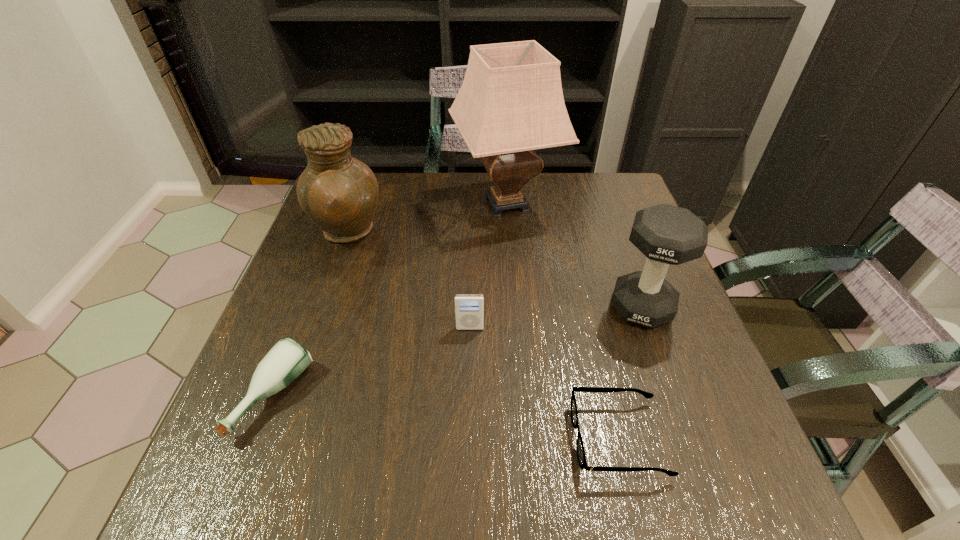
Where is `the tallest object`? The width and height of the screenshot is (960, 540). the tallest object is located at coordinates (511, 102).

Locate an element on the screen. the fifth shortest object is located at coordinates (339, 193).

Where is `dumbbell`? dumbbell is located at coordinates (667, 235).

Locate an element on the screen. The height and width of the screenshot is (540, 960). the fourth tallest object is located at coordinates (469, 308).

Find the location of a particular element. the fifth tallest object is located at coordinates (287, 359).

Identify the location of spectacles. The image size is (960, 540). (581, 456).

Locate an element on the screen. The image size is (960, 540). free space located 0.300m on the front of the lampshade is located at coordinates (516, 328).

Image resolution: width=960 pixels, height=540 pixels. I want to click on free space located at the spout of the pitcher, so click(x=490, y=233).

The height and width of the screenshot is (540, 960). Identify the location of free space located 0.380m on the left of the fourth shortest object. (438, 307).

This screenshot has height=540, width=960. What are the coordinates of `vacant region located on the front-facing side of the third shortest object` in the screenshot? It's located at (469, 354).